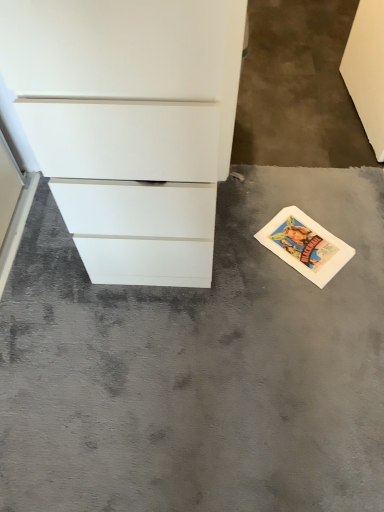
Question: Is white matte chest of drawers at left inside white paper postcard at lower right?

Choices:
 (A) no
 (B) yes

Answer: (A)

Question: From the image's perspective, is white paper postcard at lower right located above white matte chest of drawers at left?

Choices:
 (A) yes
 (B) no

Answer: (B)

Question: Considering the relative sizes of white paper postcard at lower right and white matte chest of drawers at left in the image provided, is white paper postcard at lower right thinner than white matte chest of drawers at left?

Choices:
 (A) yes
 (B) no

Answer: (A)

Question: Is white paper postcard at lower right oriented towards white matte chest of drawers at left?

Choices:
 (A) no
 (B) yes

Answer: (A)

Question: Can you confirm if white paper postcard at lower right is bigger than white matte chest of drawers at left?

Choices:
 (A) no
 (B) yes

Answer: (A)

Question: Can you confirm if white paper postcard at lower right is shorter than white matte chest of drawers at left?

Choices:
 (A) yes
 (B) no

Answer: (A)

Question: Is white matte chest of drawers at left in contact with white paper postcard at lower right?

Choices:
 (A) yes
 (B) no

Answer: (B)

Question: Is white paper postcard at lower right inside white matte chest of drawers at left?

Choices:
 (A) no
 (B) yes

Answer: (A)

Question: From a real-world perspective, is white matte chest of drawers at left on white paper postcard at lower right?

Choices:
 (A) no
 (B) yes

Answer: (B)

Question: Is white matte chest of drawers at left positioned in front of white paper postcard at lower right?

Choices:
 (A) no
 (B) yes

Answer: (B)

Question: Is white matte chest of drawers at left positioned with its back to white paper postcard at lower right?

Choices:
 (A) no
 (B) yes

Answer: (A)

Question: Is white matte chest of drawers at left to the left of white paper postcard at lower right from the viewer's perspective?

Choices:
 (A) yes
 (B) no

Answer: (A)

Question: Can you confirm if white matte chest of drawers at left is bigger than gray concrete at lower right?

Choices:
 (A) no
 (B) yes

Answer: (B)